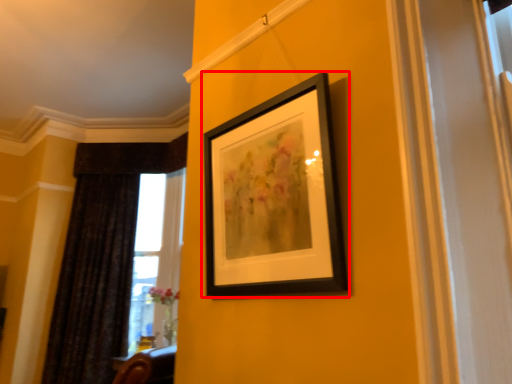
Question: From the image's perspective, where is picture frame (annotated by the red box) located relative to curtain?

Choices:
 (A) below
 (B) above

Answer: (B)